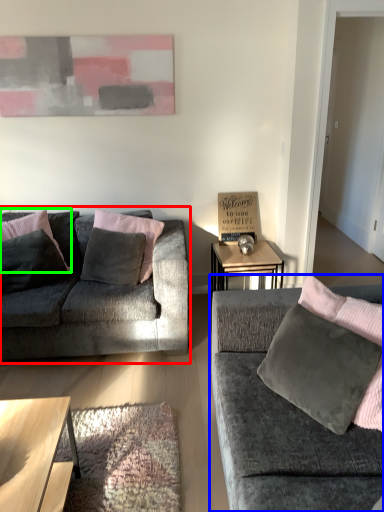
Question: Estimate the real-world distances between objects in this image. Which object is closer to studio couch (highlighted by a red box), studio couch (highlighted by a blue box) or pillow (highlighted by a green box)?

Choices:
 (A) studio couch
 (B) pillow

Answer: (B)